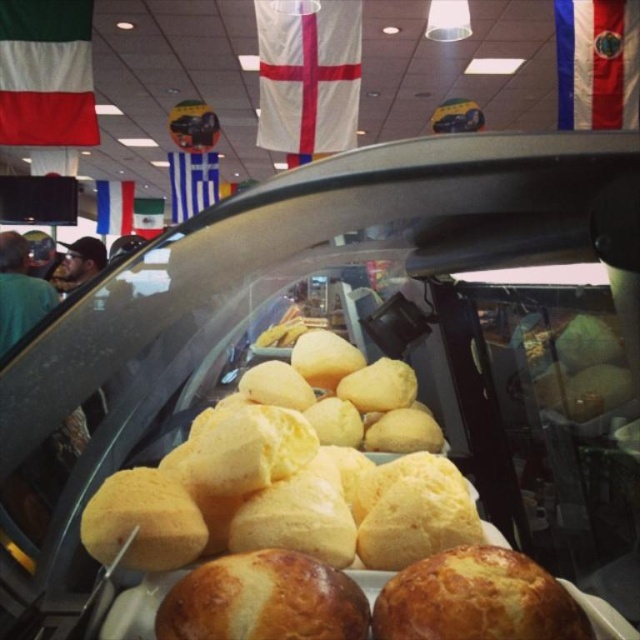
You are a customer trying to locate the golden brown crusty bread at center in the bakery display case. According to the coordinates provided, where exactly is it positioned within the case?

The golden brown crusty bread at center is located at point coordinates of 0.938 on the x axis and 0.745 on the y axis.

You are a customer entering the bakery and looking at the display case. You notice two flags above the display case entrance. The white fabric flag at upper center and the blue fabric flag at upper left. Which flag is shorter?

The white fabric flag at upper center is shorter than the blue fabric flag at upper left.

You are a customer at the bakery and want to see the items behind the display case. Can you see the blue fabric flag at upper left through the golden brown crusty bread at center?

The golden brown crusty bread at center is in front of the blue fabric flag at upper left, so you cannot see the blue fabric flag at upper left through the golden brown crusty bread at center because it is blocking the view.